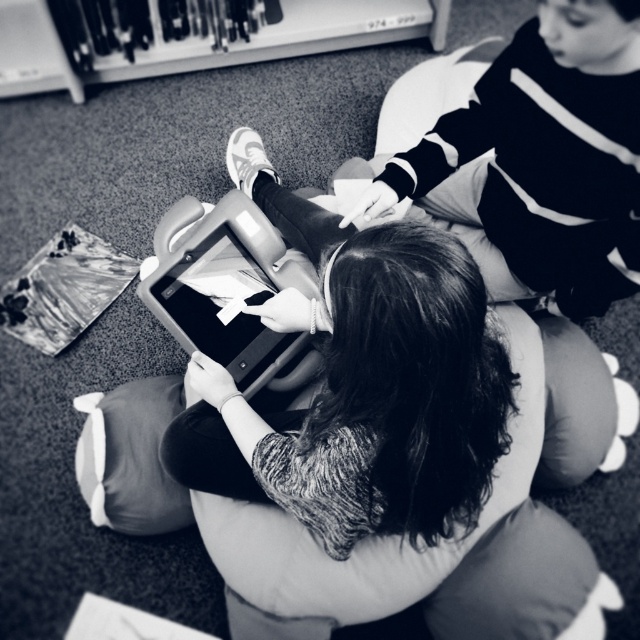
Who is taller, smooth black sweater at upper right or matte plastic tablet at center?

With more height is smooth black sweater at upper right.

In the scene shown: Between smooth black sweater at upper right and matte plastic tablet at center, which one appears on the left side from the viewer's perspective?

Positioned to the left is matte plastic tablet at center.

What do you see at coordinates (548, 154) in the screenshot?
I see `smooth black sweater at upper right` at bounding box center [548, 154].

Image resolution: width=640 pixels, height=640 pixels. In order to click on smooth black sweater at upper right in this screenshot , I will do `click(548, 154)`.